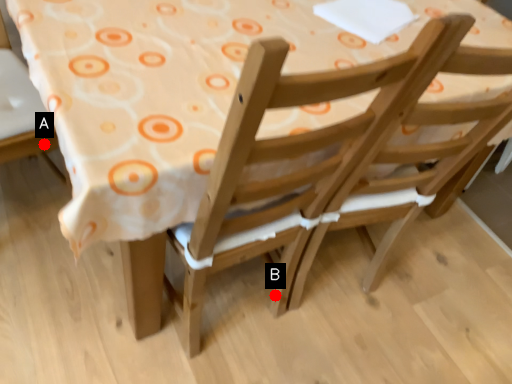
Question: Two points are circled on the image, labeled by A and B beside each circle. Which point is farther to the camera?

Choices:
 (A) A is further
 (B) B is further

Answer: (B)